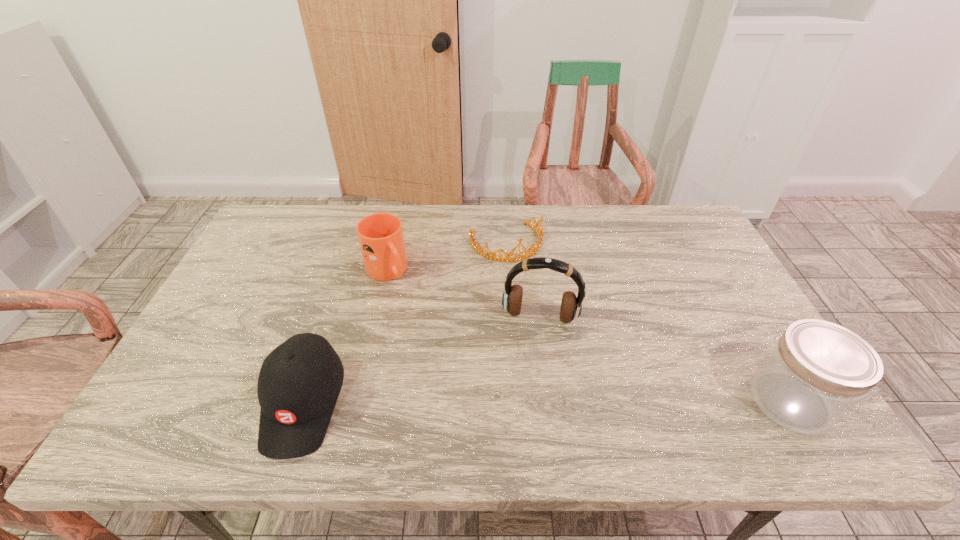
I want to click on free space on the desktop that is between the fourth tallest object and the jar and is positioned on the front-facing side of the tiara, so click(x=590, y=402).

At what (x,y) coordinates should I click in order to perform the action: click on vacant space on the desktop that is between the baseball cap and the jar and is positioned on the handle side of the mug. Please return your answer as a coordinate pair (x, y). The height and width of the screenshot is (540, 960). Looking at the image, I should click on (498, 402).

Find the location of a particular element. free space on the desktop that is between the second shortest object and the rightmost object and is positioned on the ear cup of the third nearest object is located at coordinates (530, 402).